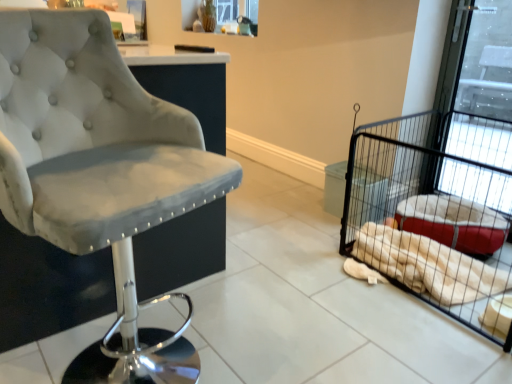
Question: In terms of width, does velvet grey chair at left look wider or thinner when compared to white plush blanket at right?

Choices:
 (A) wide
 (B) thin

Answer: (A)

Question: Choose the correct answer: Is velvet grey chair at left inside white plush blanket at right or outside it?

Choices:
 (A) outside
 (B) inside

Answer: (A)

Question: Which of these objects is positioned closest to the white plush blanket at right?

Choices:
 (A) velvet grey chair at left
 (B) black wire pet cage at right

Answer: (B)

Question: Which of these objects is positioned farthest from the black wire pet cage at right?

Choices:
 (A) velvet grey chair at left
 (B) white plush blanket at right

Answer: (A)